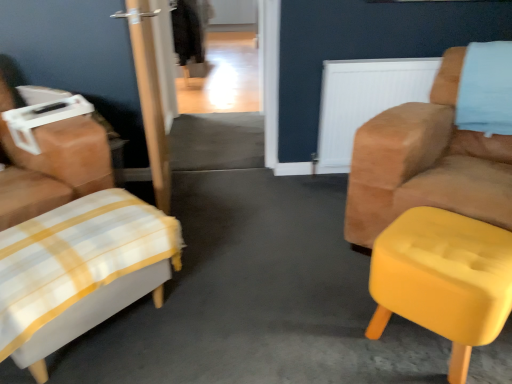
The height and width of the screenshot is (384, 512). What are the coordinates of `vacant area on top of white plaid ottoman at lower left, the second furniture from the right (from a real-world perspective)` in the screenshot? It's located at (70, 229).